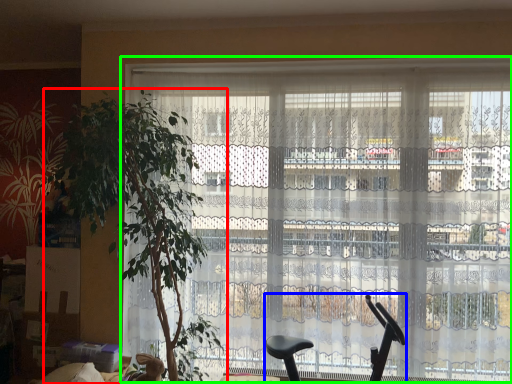
Question: Which object is positioned farthest from houseplant (highlighted by a red box)? Select from baby carriage (highlighted by a blue box) and window (highlighted by a green box).

Choices:
 (A) baby carriage
 (B) window

Answer: (A)